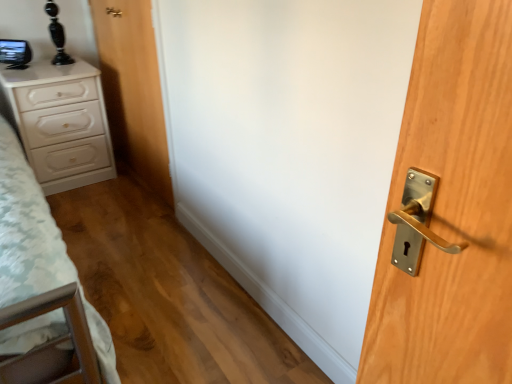
Question: Is wooden door at center thinner than white glossy chest of drawers at left?

Choices:
 (A) no
 (B) yes

Answer: (B)

Question: From the image's perspective, does wooden door at center appear lower than white glossy chest of drawers at left?

Choices:
 (A) no
 (B) yes

Answer: (A)

Question: Is wooden door at center touching white glossy chest of drawers at left?

Choices:
 (A) yes
 (B) no

Answer: (B)

Question: Considering the relative positions of wooden door at center and white glossy chest of drawers at left in the image provided, is wooden door at center to the right of white glossy chest of drawers at left from the viewer's perspective?

Choices:
 (A) yes
 (B) no

Answer: (A)

Question: Could you tell me if wooden door at center is turned towards white glossy chest of drawers at left?

Choices:
 (A) no
 (B) yes

Answer: (B)

Question: Considering the relative sizes of wooden door at center and white glossy chest of drawers at left in the image provided, is wooden door at center smaller than white glossy chest of drawers at left?

Choices:
 (A) no
 (B) yes

Answer: (B)

Question: Does white glossy chest of drawers at left appear on the left side of wooden door at center?

Choices:
 (A) no
 (B) yes

Answer: (B)

Question: Does white glossy chest of drawers at left have a smaller size compared to wooden door at center?

Choices:
 (A) no
 (B) yes

Answer: (A)

Question: Does white glossy chest of drawers at left have a lesser width compared to wooden door at center?

Choices:
 (A) yes
 (B) no

Answer: (B)

Question: Does white glossy chest of drawers at left come in front of wooden door at center?

Choices:
 (A) yes
 (B) no

Answer: (B)

Question: Considering the relative sizes of white glossy chest of drawers at left and wooden door at center in the image provided, is white glossy chest of drawers at left bigger than wooden door at center?

Choices:
 (A) yes
 (B) no

Answer: (A)

Question: Could wooden door at center be considered to be inside white glossy chest of drawers at left?

Choices:
 (A) no
 (B) yes

Answer: (A)

Question: From a real-world perspective, is wooden door at center above or below white glossy chest of drawers at left?

Choices:
 (A) above
 (B) below

Answer: (A)